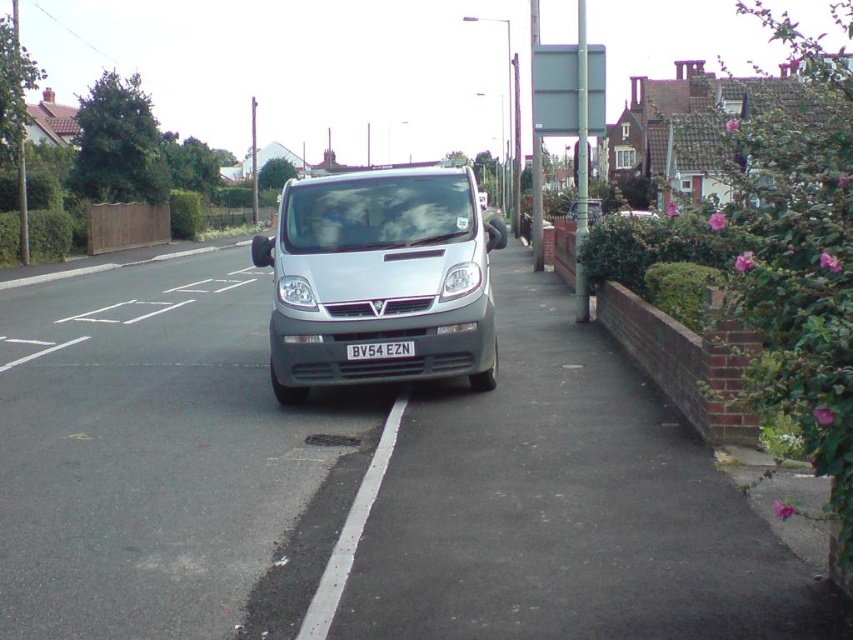
You are a delivery driver who needs to park your van in a parking bay. You see the silver metallic van at center and the white plastic license plate at center. Which object is bigger and should you consider its size when choosing a parking spot?

The silver metallic van at center is larger than the white plastic license plate at center. When choosing a parking spot, you should consider the size of the silver metallic van at center to ensure there is enough space for your vehicle.